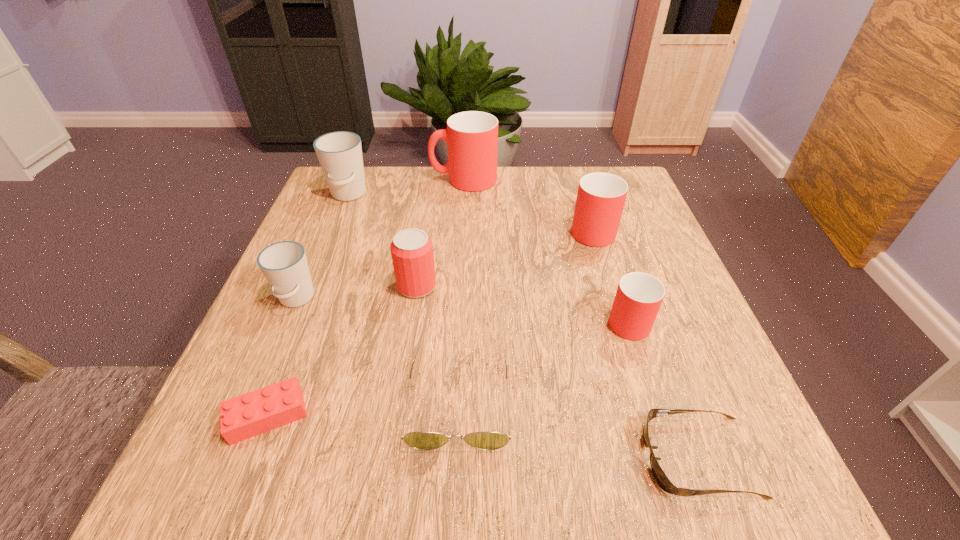
You are a GUI agent. You are given a task and a screenshot of the screen. Output one action in this format:
    pyautogui.click(x=<x>, y=<y>)
    Task: Click on the Lego
    The image size is (960, 540).
    Given the screenshot: What is the action you would take?
    pyautogui.click(x=254, y=413)

Identify the location of the right sunglasses. (663, 481).

Image resolution: width=960 pixels, height=540 pixels. I want to click on blank space located on the side of the third cup from left to right with the handle, so click(x=334, y=180).

Locate an element on the screen. vacant space located on the side of the third cup from left to right with the handle is located at coordinates (404, 180).

At what (x,y) coordinates should I click in order to perform the action: click on free region located on the side of the third cup from left to right with the handle. Please return your answer as a coordinate pair (x, y). The height and width of the screenshot is (540, 960). Looking at the image, I should click on (375, 180).

You are a GUI agent. You are given a task and a screenshot of the screen. Output one action in this format:
    pyautogui.click(x=<x>, y=<y>)
    Task: Click on the free space located 0.150m with a handle on the side of the bigger white cup
    Image resolution: width=960 pixels, height=540 pixels.
    Given the screenshot: What is the action you would take?
    pyautogui.click(x=327, y=247)

The height and width of the screenshot is (540, 960). What are the coordinates of `vacant space located 0.070m on the side of the third nearest cup with the handle` in the screenshot? It's located at coord(582,195).

Locate an element on the screen. The height and width of the screenshot is (540, 960). free spot located 0.090m on the side of the third nearest cup with the handle is located at coordinates (580, 191).

At what (x,y) coordinates should I click in order to perform the action: click on free space located on the side of the third nearest cup with the handle. Please return your answer as a coordinate pair (x, y). The width and height of the screenshot is (960, 540). Looking at the image, I should click on (580, 191).

You are a GUI agent. You are given a task and a screenshot of the screen. Output one action in this format:
    pyautogui.click(x=<x>, y=<y>)
    Task: Click on the vacant space located on the back of the red beer can
    Image resolution: width=960 pixels, height=540 pixels.
    Given the screenshot: What is the action you would take?
    pyautogui.click(x=429, y=206)